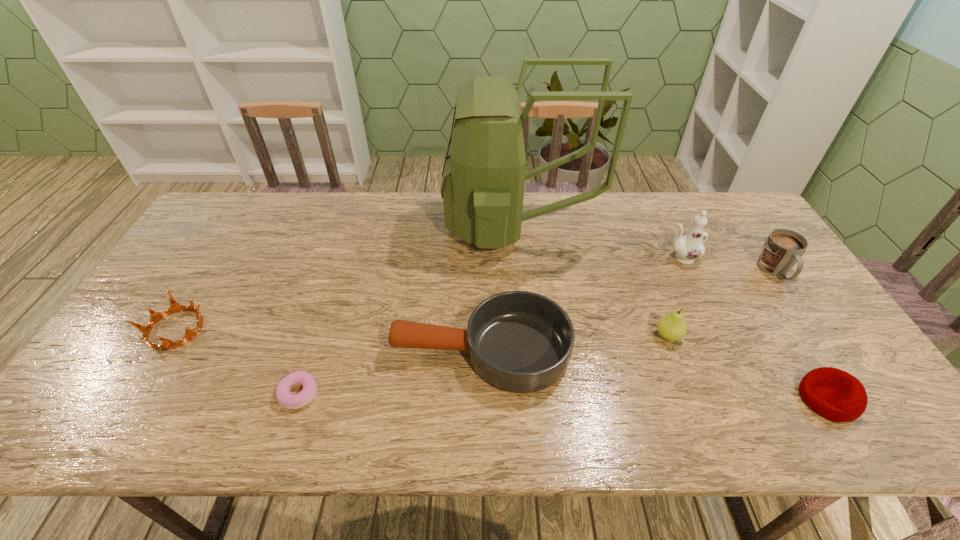
Locate an element on the screen. vacant area situated 0.310m on the handle side of the pan is located at coordinates (270, 350).

Where is `vacant space situated 0.380m on the seat area of the beanbag`? vacant space situated 0.380m on the seat area of the beanbag is located at coordinates (636, 399).

Find the location of a particular element. blank area located 0.170m on the seat area of the beanbag is located at coordinates (727, 399).

This screenshot has width=960, height=540. I want to click on vacant space located on the seat area of the beanbag, so click(654, 399).

Locate an element on the screen. free space located 0.180m on the front of the crown is located at coordinates (119, 422).

Where is `vacant space located 0.310m on the right of the shortest object`? The height and width of the screenshot is (540, 960). vacant space located 0.310m on the right of the shortest object is located at coordinates (x=452, y=394).

Where is `object positioned at the far edge`? object positioned at the far edge is located at coordinates (483, 178).

Identify the location of beanbag located at the near edge. This screenshot has width=960, height=540. (836, 395).

Identify the location of pastry that is at the near edge. (307, 394).

Where is `object present at the left edge`? This screenshot has height=540, width=960. object present at the left edge is located at coordinates (155, 317).